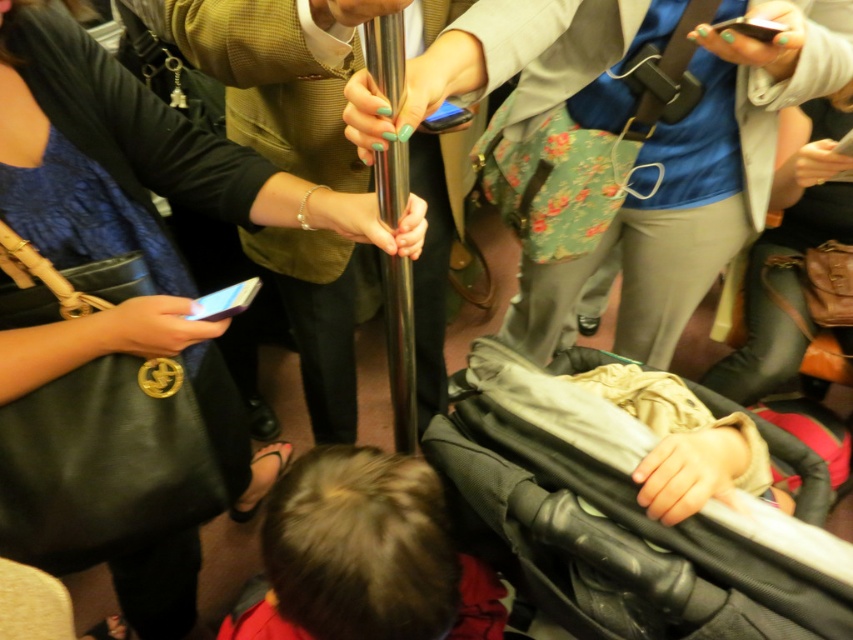
You are a delivery person who needs to place a 50 cm long package between the matte black handbag at upper left and the floral fabric backpack at center. Can you fit the package in the space between them?

The distance between the matte black handbag at upper left and the floral fabric backpack at center is 54.18 centimeters. Since the package is 50 cm long, it can fit in the space between them as there is enough room.